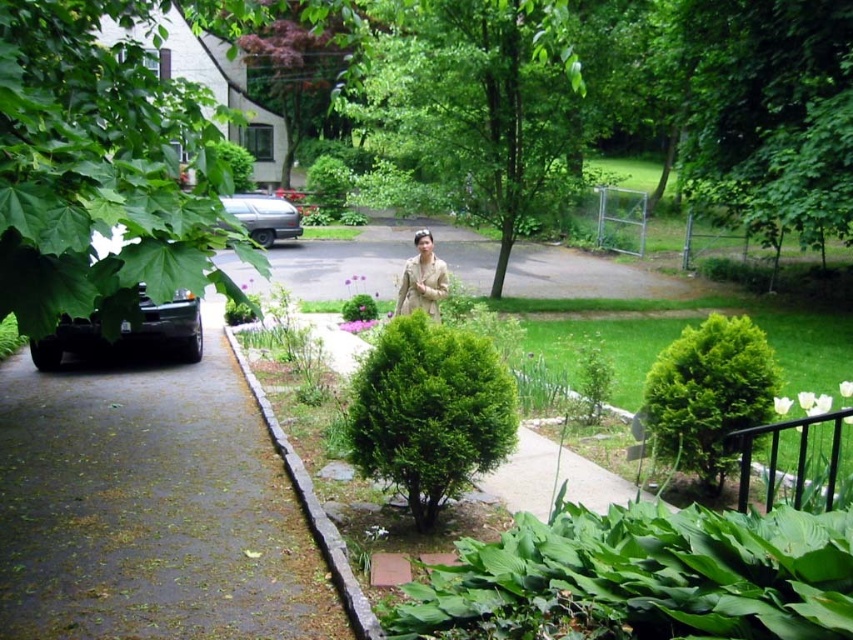
You are a photographer setting up a shot in the residential outdoor scene. You have to decide whether to focus on the green textured bush at right or the tan fabric jacket at center. Based on their sizes in the image, which object should you prioritize to ensure it fits within your camera frame?

The tan fabric jacket at center should be prioritized because the green textured bush at right occupies less space, meaning the jacket is larger and would require more focus to fit properly within the camera frame.

In the scene shown: You are a gardener who needs to water two bushes in the garden. The green leafy bush at center and the green textured bush at right are both in need of water. If your watering can holds enough water for 5 feet of travel, can you water both bushes without needing to refill?

The distance between the green leafy bush at center and the green textured bush at right is 5.13 feet. Since your watering can allows you to travel 5 feet before needing a refill, you would need to refill after watering one of the bushes because the distance exceeds the 5 foot limit.

You are standing at the edge of the driveway and want to walk towards the green textured bush at right. Which direction should you go relative to the green leafy bush at center?

You should walk to the right of the green leafy bush at center because the green textured bush at right is positioned on the right side of it.